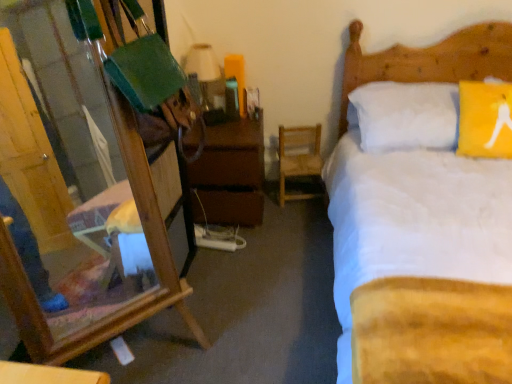
Question: Is wooden mirror at left located within brown wooden nightstand at center?

Choices:
 (A) yes
 (B) no

Answer: (B)

Question: Is the position of brown wooden nightstand at center more distant than that of wooden mirror at left?

Choices:
 (A) yes
 (B) no

Answer: (A)

Question: Does brown wooden nightstand at center appear on the right side of wooden mirror at left?

Choices:
 (A) yes
 (B) no

Answer: (A)

Question: From a real-world perspective, is brown wooden nightstand at center physically above wooden mirror at left?

Choices:
 (A) yes
 (B) no

Answer: (B)

Question: Is brown wooden nightstand at center positioned before wooden mirror at left?

Choices:
 (A) no
 (B) yes

Answer: (A)

Question: Is there a large distance between brown wooden nightstand at center and wooden mirror at left?

Choices:
 (A) yes
 (B) no

Answer: (B)

Question: Can you confirm if brown wooden nightstand at center is wider than matte white lampshade at upper center?

Choices:
 (A) yes
 (B) no

Answer: (A)

Question: Can you confirm if brown wooden nightstand at center is smaller than matte white lampshade at upper center?

Choices:
 (A) yes
 (B) no

Answer: (B)

Question: Is brown wooden nightstand at center positioned with its back to matte white lampshade at upper center?

Choices:
 (A) yes
 (B) no

Answer: (B)

Question: Is brown wooden nightstand at center at the left side of matte white lampshade at upper center?

Choices:
 (A) yes
 (B) no

Answer: (B)

Question: Is brown wooden nightstand at center to the right of matte white lampshade at upper center from the viewer's perspective?

Choices:
 (A) yes
 (B) no

Answer: (A)

Question: Considering the relative positions of brown wooden nightstand at center and matte white lampshade at upper center in the image provided, is brown wooden nightstand at center behind matte white lampshade at upper center?

Choices:
 (A) yes
 (B) no

Answer: (B)

Question: From the image's perspective, would you say matte white lampshade at upper center is positioned over white soft bed at upper right?

Choices:
 (A) yes
 (B) no

Answer: (A)